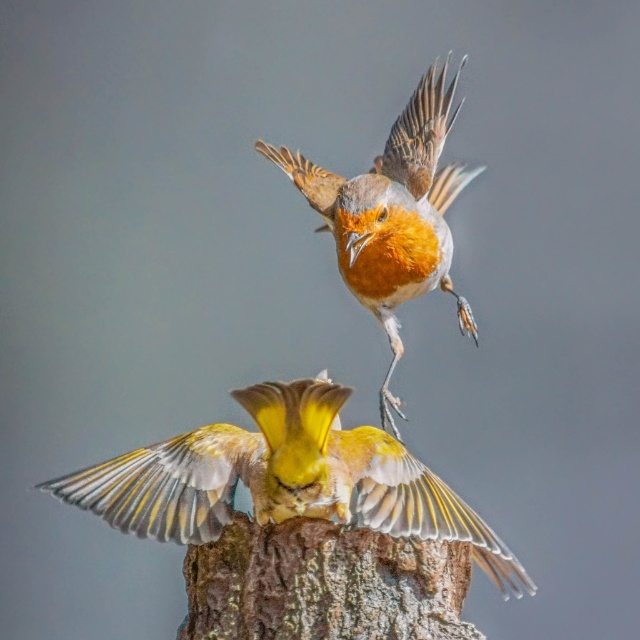
Does point (369, 593) come closer to viewer compared to point (406, 160)?

That is True.

What do you see at coordinates (323, 584) in the screenshot? I see `brown rough tree trunk at center` at bounding box center [323, 584].

Locate an element on the screen. This screenshot has width=640, height=640. brown rough tree trunk at center is located at coordinates (323, 584).

Which is more to the right, yellow matte bird at center or bright orange feathers at center?

bright orange feathers at center is more to the right.

Does yellow matte bird at center have a greater height compared to bright orange feathers at center?

No, yellow matte bird at center is not taller than bright orange feathers at center.

Image resolution: width=640 pixels, height=640 pixels. I want to click on yellow matte bird at center, so click(284, 480).

Can you confirm if yellow matte bird at center is positioned above brown rough tree trunk at center?

Indeed, yellow matte bird at center is positioned over brown rough tree trunk at center.

Between point (225, 522) and point (248, 516), which one is positioned behind?

Point (248, 516)

Where is `yellow matte bird at center`? yellow matte bird at center is located at coordinates (284, 480).